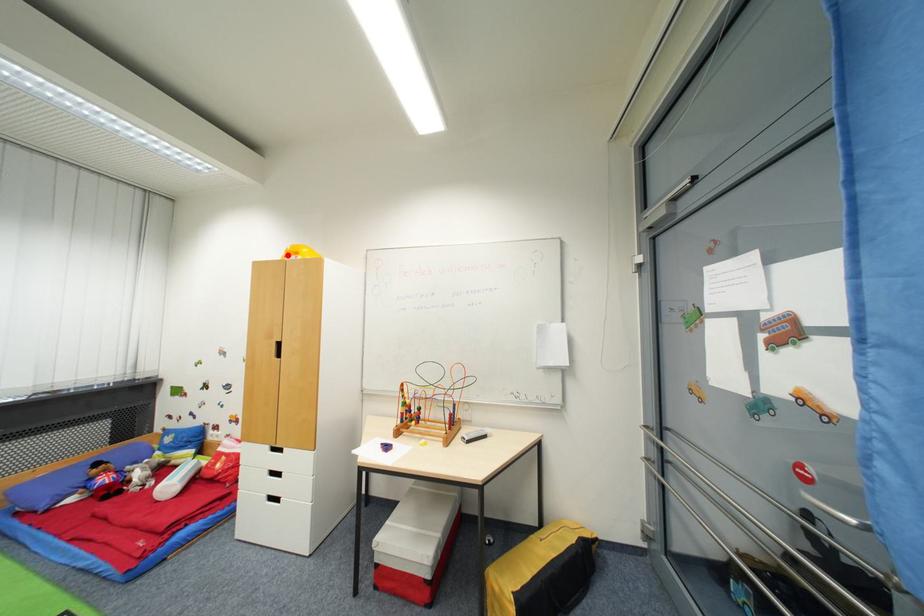
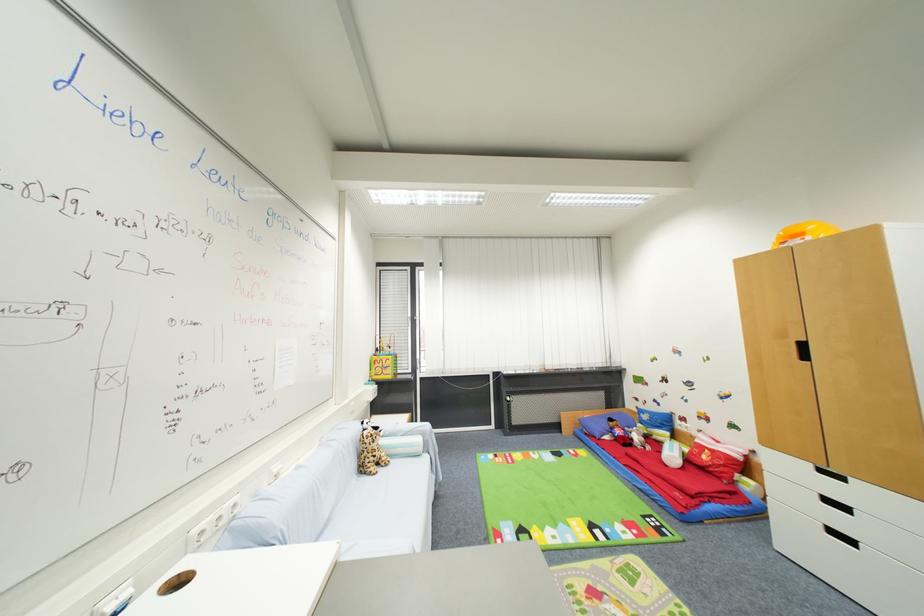
The point at the highlighted location is marked in the first image. Where is the corresponding point in the second image?

(779, 243)